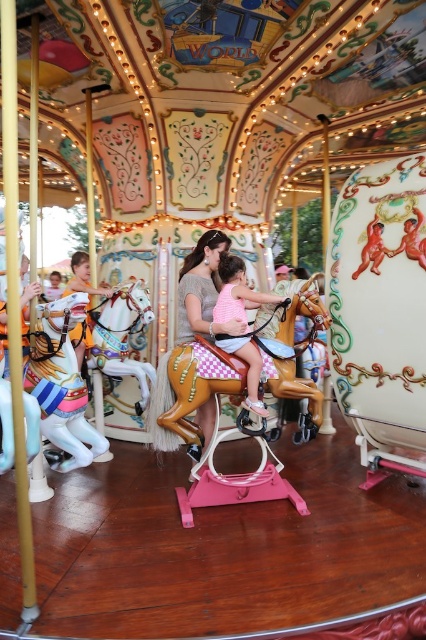
You are a child trying to reach the top of the painted wood horse at left and the light brown wooden horse at left. Which horse will you need to climb higher to touch its top?

The light brown wooden horse at left is taller than the painted wood horse at left, so you will need to climb higher to touch the top of the light brown wooden horse at left.

You are a child who is 1.3 meters tall and want to reach the top of the wooden polished horse at center from the light brown wooden horse at left. Can you stretch your hand and touch it?

The wooden polished horse at center is 1.29 meters from the light brown wooden horse at left. Since you are 1.3 meters tall, you can stretch your hand and touch the top of the wooden polished horse at center as your height is slightly taller than the distance between them.